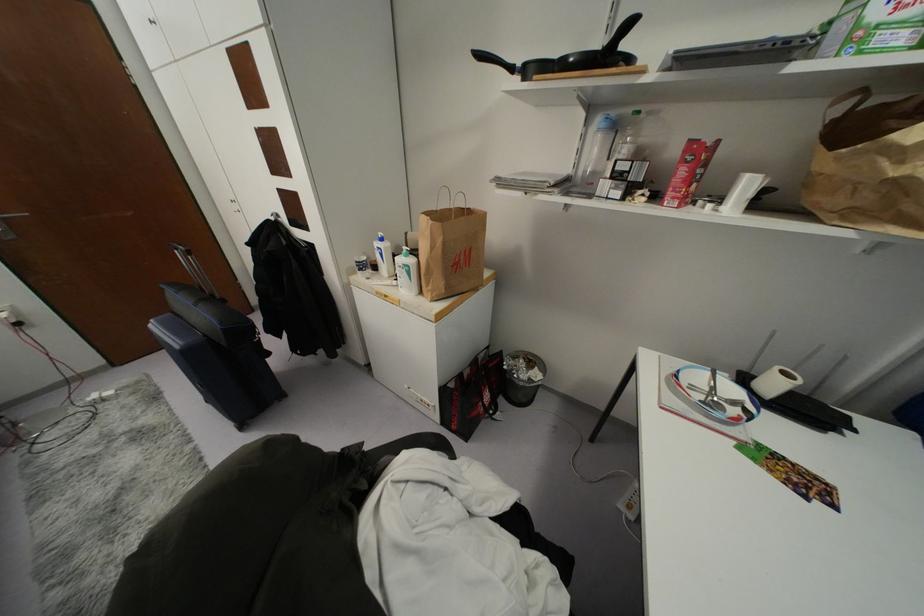
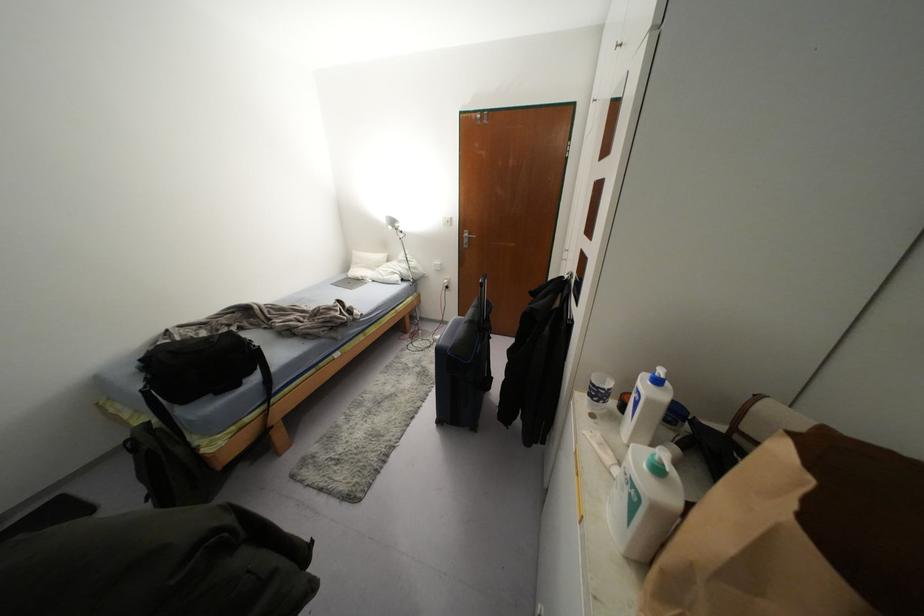
The point at (x=359, y=270) is marked in the first image. Where is the corresponding point in the second image?

(590, 395)